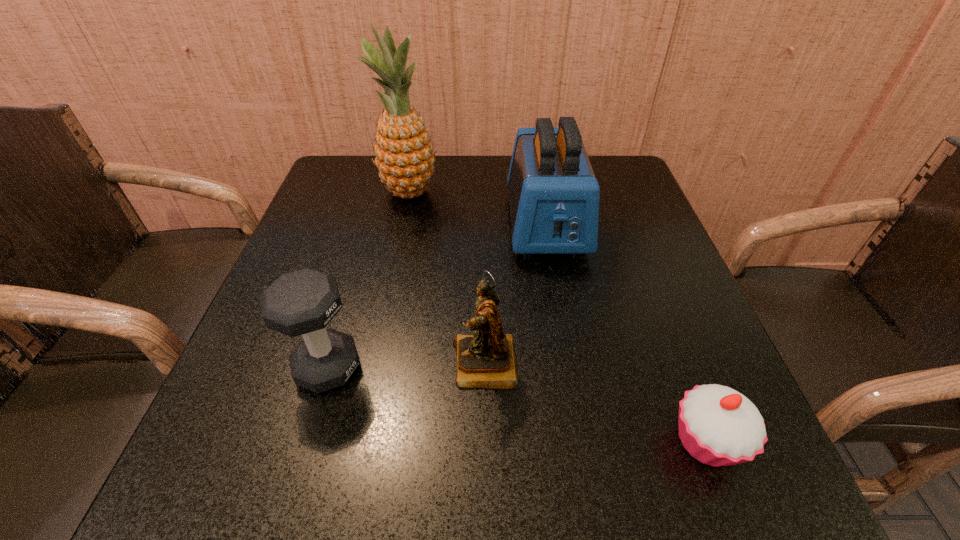
At what (x,y) coordinates should I click in order to perform the action: click on object located at the far left corner. Please return your answer as a coordinate pair (x, y). This screenshot has height=540, width=960. Looking at the image, I should click on click(x=404, y=152).

This screenshot has width=960, height=540. I want to click on object located in the near right corner section of the desktop, so click(718, 426).

Identify the location of free space at the far edge. (430, 190).

Image resolution: width=960 pixels, height=540 pixels. In the image, there is a desktop. In order to click on vacant space at the left edge in this screenshot , I will do `click(331, 213)`.

In the image, there is a desktop. Where is `blank space at the right edge`? blank space at the right edge is located at coordinates (655, 314).

The image size is (960, 540). Identify the location of vacant space at the far left corner of the desktop. (339, 155).

Locate an element on the screen. The height and width of the screenshot is (540, 960). vacant region at the near left corner of the desktop is located at coordinates (169, 510).

In the image, there is a desktop. Identify the location of vacant space at the far right corner. (605, 183).

You are a GUI agent. You are given a task and a screenshot of the screen. Output one action in this format:
    pyautogui.click(x=<x>, y=<y>)
    Task: Click on the free spot between the figurine and the fourth shortest object
    
    Given the screenshot: What is the action you would take?
    pyautogui.click(x=516, y=294)

At what (x,y) coordinates should I click in order to perform the action: click on free space between the cupcake and the dumbbell. Please return your answer as a coordinate pair (x, y). The image size is (960, 540). Looking at the image, I should click on click(x=517, y=404).